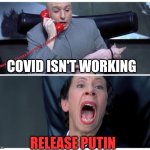
Locate an element on the screen. red phone cord is located at coordinates (23, 56).